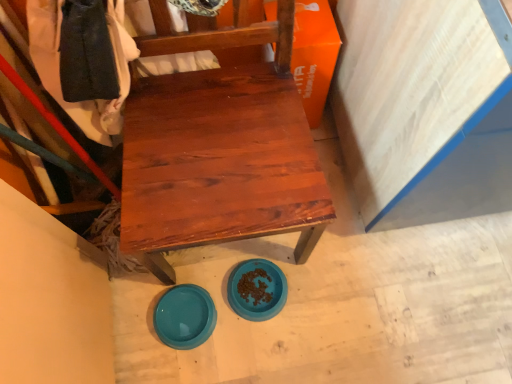
Question: Looking at the image, does orange matte cardboard box at upper right seem bigger or smaller compared to teal glossy plate at lower center, which is the second plate in right-to-left order?

Choices:
 (A) big
 (B) small

Answer: (A)

Question: Does point (298, 91) appear closer or farther from the camera than point (200, 307)?

Choices:
 (A) farther
 (B) closer

Answer: (B)

Question: Which object is positioned farthest from the matte wood chair at center?

Choices:
 (A) teal glossy plate at lower center, arranged as the 1th plate when viewed from the left
 (B) orange matte cardboard box at upper right
 (C) blue plastic bowl at lower center, marked as the 2th plate in a left-to-right arrangement

Answer: (A)

Question: Which is farther from the teal glossy plate at lower center, which is the second plate in right-to-left order?

Choices:
 (A) orange matte cardboard box at upper right
 (B) blue plastic bowl at lower center, marked as the 2th plate in a left-to-right arrangement
 (C) matte wood chair at center

Answer: (A)